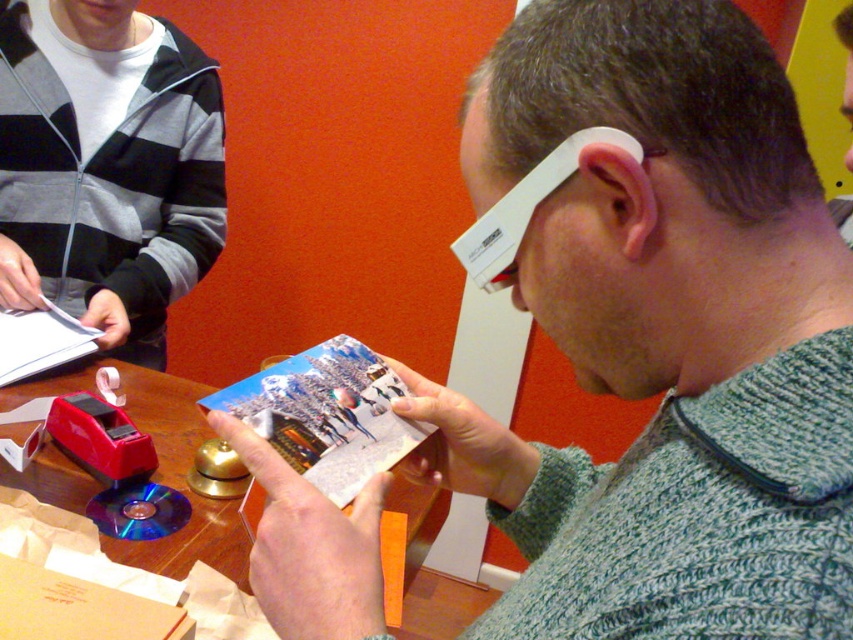
Question: In this image, where is striped cotton hoodie at upper left located relative to printed paper magazine at center?

Choices:
 (A) above
 (B) below

Answer: (A)

Question: Which point is closer to the camera?

Choices:
 (A) (357, 476)
 (B) (607, 244)

Answer: (B)

Question: Can you confirm if striped cotton hoodie at upper left is wider than printed paper magazine at center?

Choices:
 (A) no
 (B) yes

Answer: (B)

Question: Based on their relative distances, which object is nearer to the printed paper magazine at center?

Choices:
 (A) striped cotton hoodie at upper left
 (B) green knitted sweater at center
 (C) wooden table at center
 (D) matte paper magazine at center

Answer: (B)

Question: From the image, what is the correct spatial relationship of striped cotton hoodie at upper left in relation to printed paper magazine at center?

Choices:
 (A) above
 (B) below

Answer: (A)

Question: Which point is farther to the camera?

Choices:
 (A) printed paper magazine at center
 (B) wooden table at center

Answer: (B)